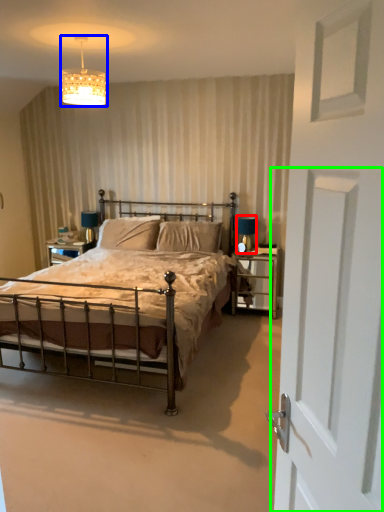
Question: Considering the real-world distances, which object is closest to table lamp (highlighted by a red box)? lighting (highlighted by a blue box) or screen door (highlighted by a green box).

Choices:
 (A) lighting
 (B) screen door

Answer: (A)